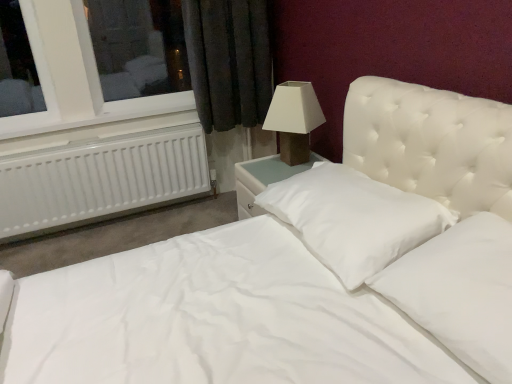
Question: In terms of size, does white soft pillow at center, which is the second pillow in back-to-front order, appear bigger or smaller than matte brown lamp at upper right?

Choices:
 (A) small
 (B) big

Answer: (A)

Question: From the image's perspective, is white soft pillow at center, which is the second pillow in back-to-front order, positioned above or below matte brown lamp at upper right?

Choices:
 (A) above
 (B) below

Answer: (B)

Question: Based on their relative distances, which object is nearer to the white smooth pillow at center, which is the 1th pillow in back-to-front order?

Choices:
 (A) white plastic radiator at left
 (B) matte brown lamp at upper right
 (C) white plastic radiator at left
 (D) white soft pillow at center, which is the second pillow in back-to-front order

Answer: (D)

Question: Which is farther from the white smooth pillow at center, marked as the second pillow in a front-to-back arrangement?

Choices:
 (A) matte brown lamp at upper right
 (B) white soft pillow at center, which is the second pillow in back-to-front order
 (C) white plastic radiator at left
 (D) white plastic radiator at left

Answer: (D)